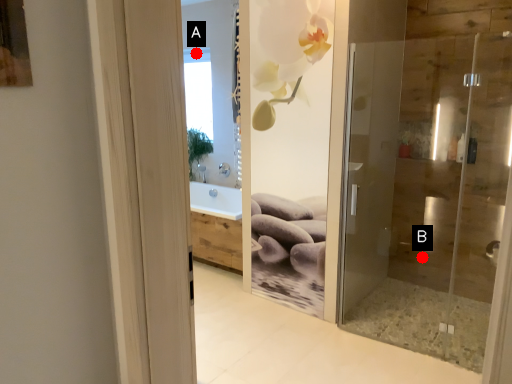
Question: Two points are circled on the image, labeled by A and B beside each circle. Which point is closer to the camera?

Choices:
 (A) A is closer
 (B) B is closer

Answer: (B)